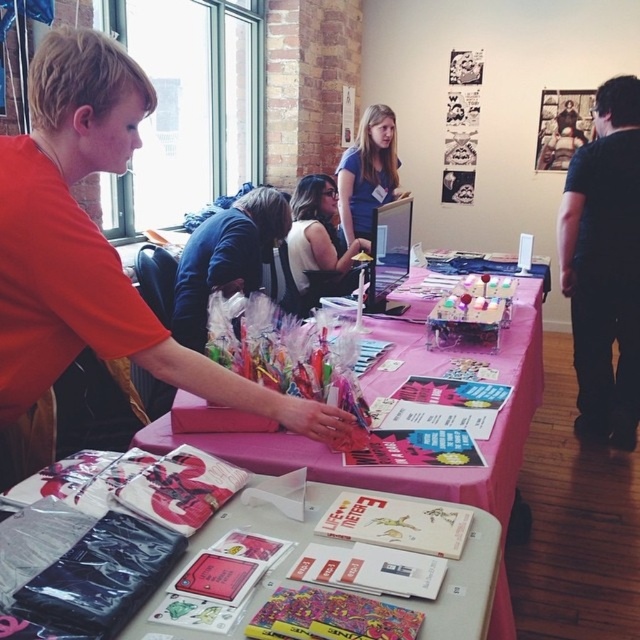
Question: Is pink fabric tablecloth at center to the left of white paper goods at center from the viewer's perspective?

Choices:
 (A) yes
 (B) no

Answer: (B)

Question: Among these points, which one is nearest to the camera?

Choices:
 (A) (609, 276)
 (B) (339, 196)
 (C) (225, 452)
 (D) (170, 632)

Answer: (D)

Question: Does matte orange shirt at left appear on the left side of black cotton shirt at right?

Choices:
 (A) no
 (B) yes

Answer: (B)

Question: Which of the following is the farthest from the observer?

Choices:
 (A) (19, 448)
 (B) (369, 228)

Answer: (B)

Question: Which of these objects is positioned closest to the blue cotton shirt at center?

Choices:
 (A) white fabric shirt at center
 (B) black cotton shirt at right

Answer: (A)

Question: In this image, where is white paper goods at center located relative to blue cotton shirt at center?

Choices:
 (A) below
 (B) above

Answer: (A)